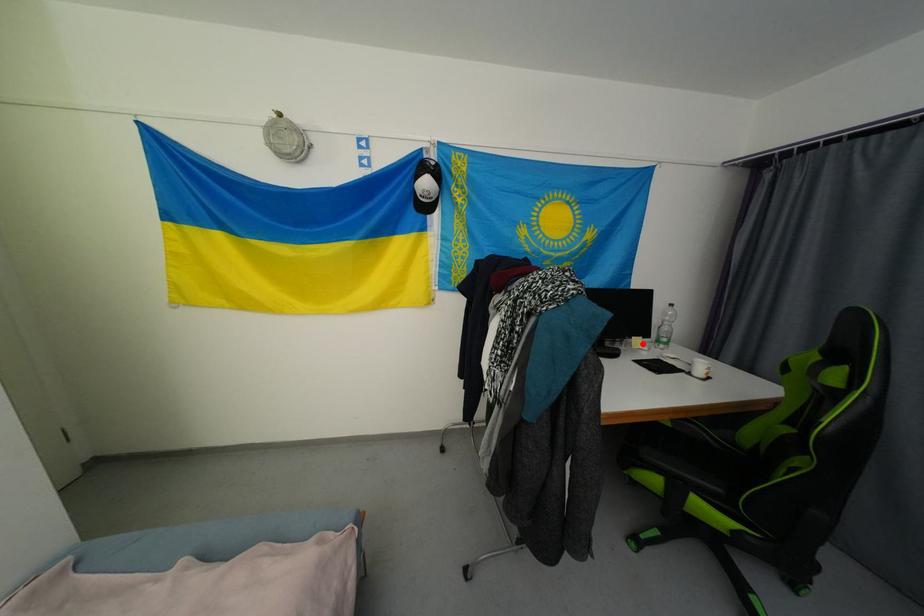
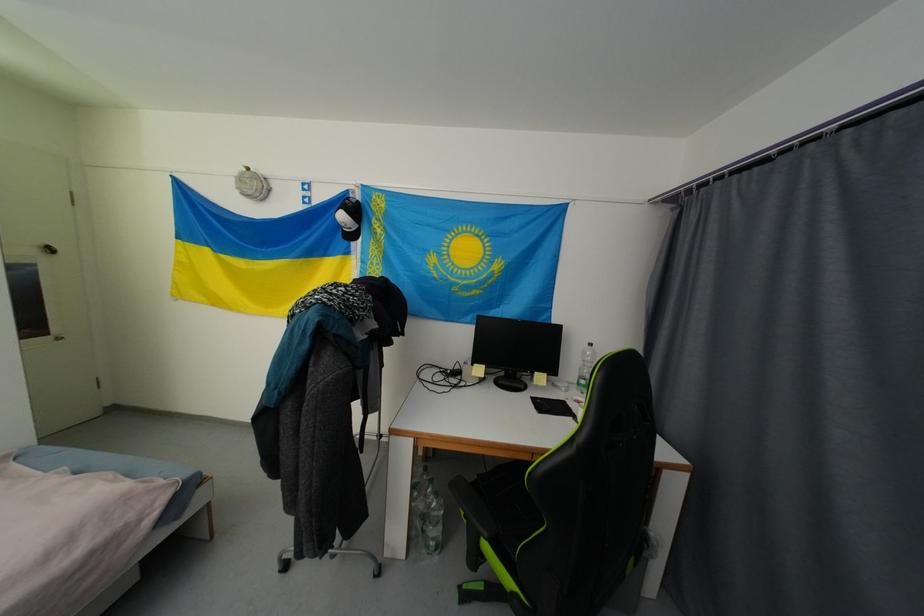
Question: I am providing you with two images of the same scene from different viewpoints. In image1, a red point is highlighted. Considering the same 3D point in image2, which of the following is correct?

Choices:
 (A) It is closer
 (B) It is farther

Answer: (B)